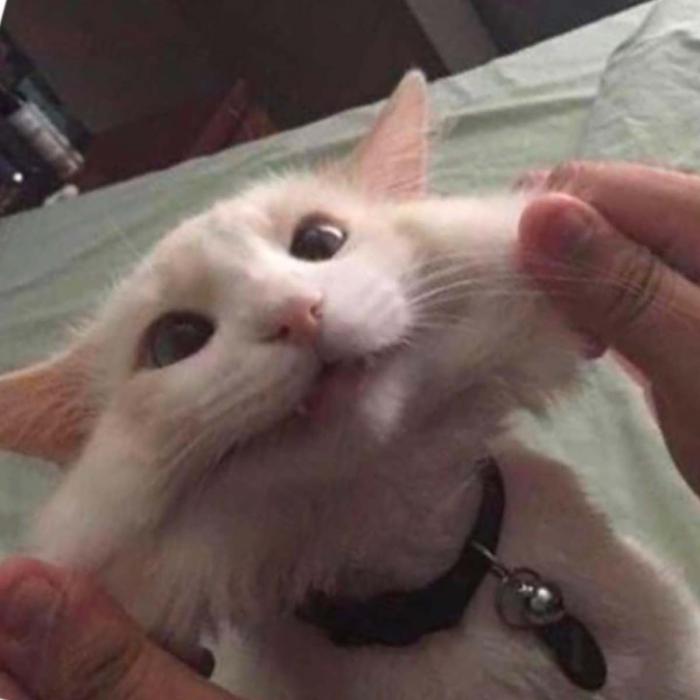
At what (x,y) coordinates should I click in order to perform the action: click on end table. Please return your answer as a coordinate pair (x, y). Looking at the image, I should click on (146, 152).